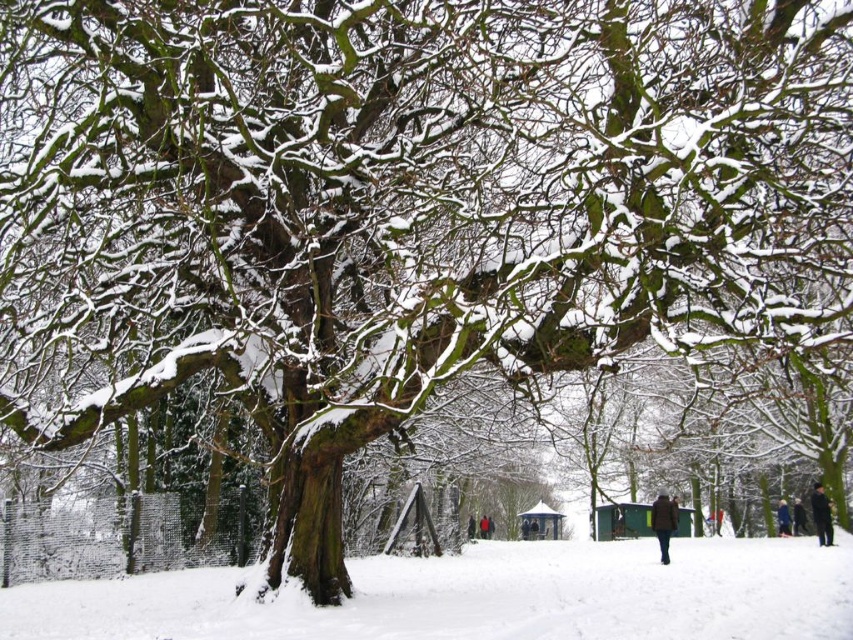
Question: Which point appears farthest from the camera in this image?

Choices:
 (A) (779, 516)
 (B) (669, 531)
 (C) (821, 506)
 (D) (175, 572)

Answer: (A)

Question: Does black fabric person at lower right have a smaller size compared to black wool coat at lower right?

Choices:
 (A) yes
 (B) no

Answer: (B)

Question: Considering the real-world distances, which object is closest to the black wool coat at lower right?

Choices:
 (A) dark blue jacket at lower right
 (B) white fluffy snow at lower center
 (C) dark brown coat at center
 (D) black fabric person at lower right

Answer: (A)

Question: Which object is the closest to the dark brown coat at center?

Choices:
 (A) white fluffy snow at lower center
 (B) black fabric person at lower right

Answer: (B)

Question: Is dark brown coat at center smaller than black fabric person at lower right?

Choices:
 (A) no
 (B) yes

Answer: (A)

Question: Does dark brown coat at center have a larger size compared to black wool coat at lower right?

Choices:
 (A) yes
 (B) no

Answer: (A)